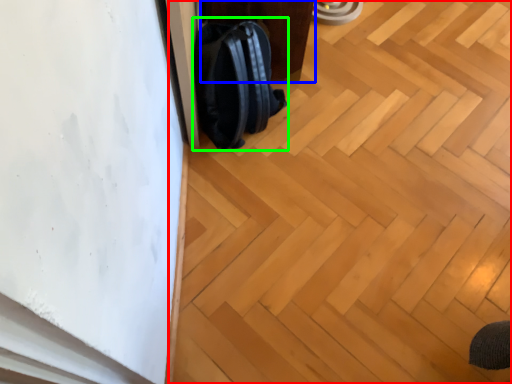
Question: Which is farther away from plywood (highlighted by a red box)? furniture (highlighted by a blue box) or backpack (highlighted by a green box)?

Choices:
 (A) furniture
 (B) backpack

Answer: (A)